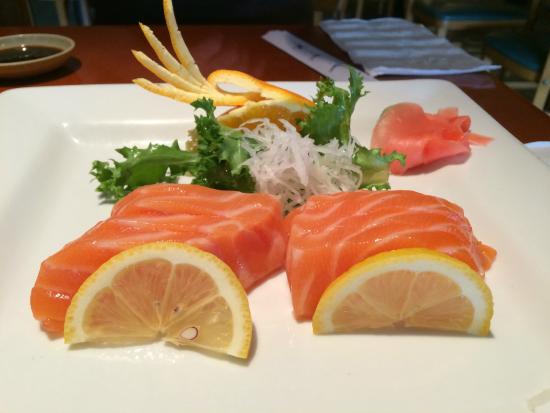
Image resolution: width=550 pixels, height=413 pixels. I want to click on decorative orange slice, so click(x=254, y=107).